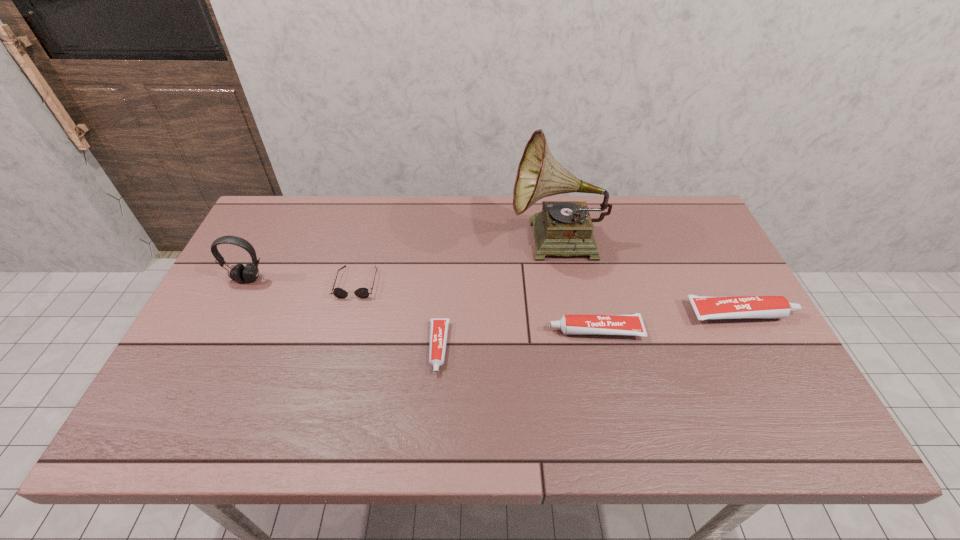
This screenshot has height=540, width=960. I want to click on object at the left edge, so click(239, 273).

Locate an element on the screen. This screenshot has height=540, width=960. object situated at the right edge is located at coordinates (705, 307).

Locate an element on the screen. This screenshot has height=540, width=960. vacant area at the far edge is located at coordinates (635, 230).

This screenshot has height=540, width=960. In the image, there is a desktop. Find the location of `vacant space at the near edge`. vacant space at the near edge is located at coordinates (409, 395).

The height and width of the screenshot is (540, 960). I want to click on vacant region at the left edge of the desktop, so point(240,296).

I want to click on free location at the right edge of the desktop, so click(705, 337).

Image resolution: width=960 pixels, height=540 pixels. I want to click on vacant space at the far left corner of the desktop, so click(x=283, y=221).

This screenshot has height=540, width=960. What are the coordinates of `vacant space at the far right corner` in the screenshot? It's located at (682, 208).

Where is `free space at the near right corner`? The width and height of the screenshot is (960, 540). free space at the near right corner is located at coordinates (762, 381).

You are a GUI agent. You are given a task and a screenshot of the screen. Output one action in this format:
    pyautogui.click(x=<x>, y=<y>)
    Task: Click on the free space between the record player and the second shortest object
    The width and height of the screenshot is (960, 540).
    Given the screenshot: What is the action you would take?
    pyautogui.click(x=457, y=262)